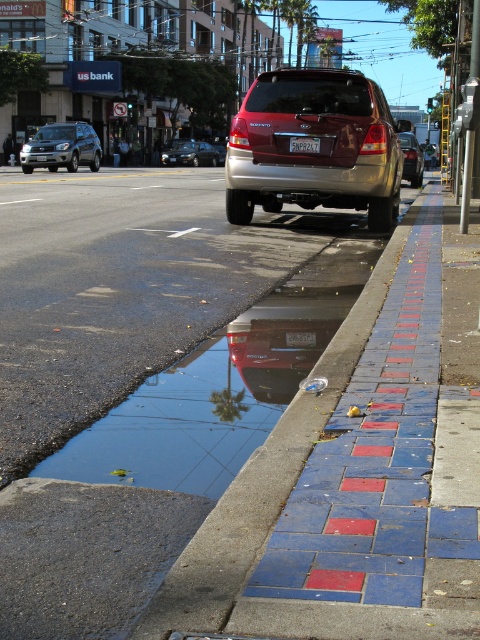
Consider the image. Is blue brick sidewalk at lower right below black plastic license plate at center?

Yes, blue brick sidewalk at lower right is below black plastic license plate at center.

In order to click on blue brick sidewalk at lower right in this screenshot , I will do `click(165, 458)`.

The height and width of the screenshot is (640, 480). I want to click on blue brick sidewalk at lower right, so click(165, 458).

Does point (261, 152) come in front of point (418, 172)?

Yes, point (261, 152) is in front of point (418, 172).

Between point (376, 227) and point (420, 177), which one is positioned behind?

Point (420, 177)

Which is behind, point (398, 180) or point (400, 141)?

Positioned behind is point (400, 141).

Find the location of a particular element. The image size is (480, 640). maroon metallic suv at center is located at coordinates (320, 147).

Can you confirm if metallic silver suv at center is thinner than white plastic license plate at center?

In fact, metallic silver suv at center might be wider than white plastic license plate at center.

Is point (417, 163) positioned after point (305, 141)?

Yes, it is behind point (305, 141).

Between point (414, 136) and point (319, 140), which one is positioned behind?

The point (414, 136) is more distant.

Find the location of a particular element. metallic silver suv at center is located at coordinates (411, 157).